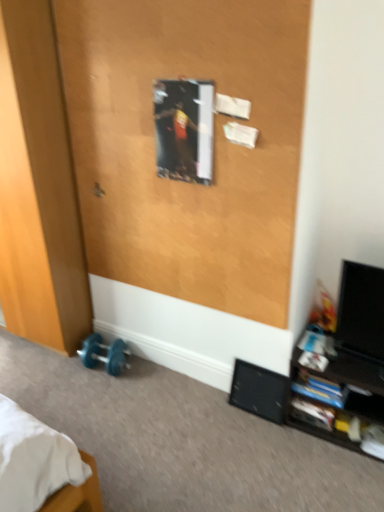
Find the location of a particular element. Image resolution: width=384 pixels, height=512 pixels. free location to the left of blue rubber dumbbell at lower left is located at coordinates pyautogui.click(x=60, y=372).